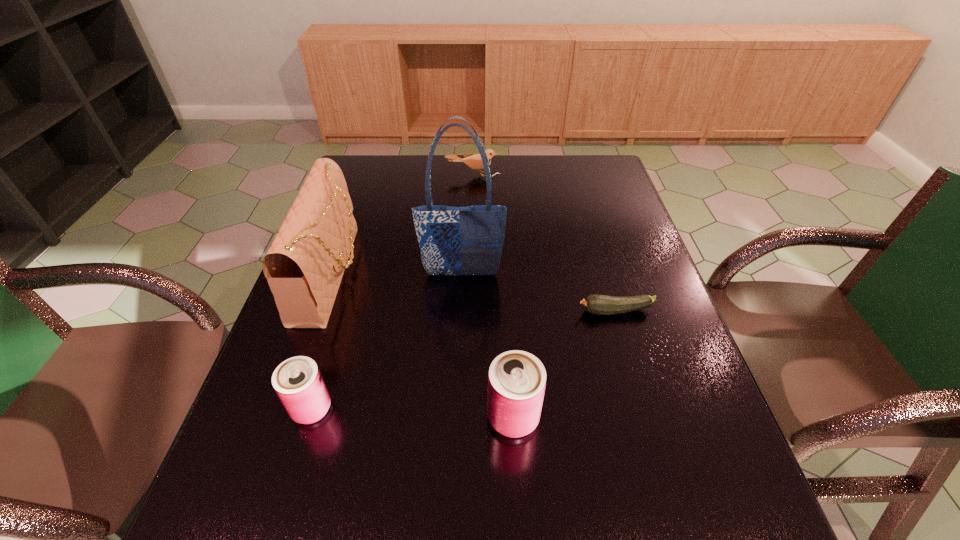
Where is `handbag present at the left edge`? handbag present at the left edge is located at coordinates (304, 267).

Find the location of a particular element. This screenshot has width=960, height=540. object at the right edge is located at coordinates (595, 304).

Identify the location of object situated at the near left corner. (298, 382).

In the image, there is a desktop. Identify the location of vacant space at the far edge. The width and height of the screenshot is (960, 540). (504, 156).

The width and height of the screenshot is (960, 540). In the image, there is a desktop. Identify the location of vacant space at the near edge. (623, 459).

Identify the location of vacant space at the left edge. (346, 352).

In the image, there is a desktop. Identify the location of free region at the right edge. (616, 239).

The width and height of the screenshot is (960, 540). Find the location of `free space at the far left corner`. free space at the far left corner is located at coordinates click(384, 158).

Locate an element on the screen. The width and height of the screenshot is (960, 540). free point at the near left corner is located at coordinates (238, 468).

In the image, there is a desktop. Where is `free space at the far right corner`? The image size is (960, 540). free space at the far right corner is located at coordinates (586, 158).